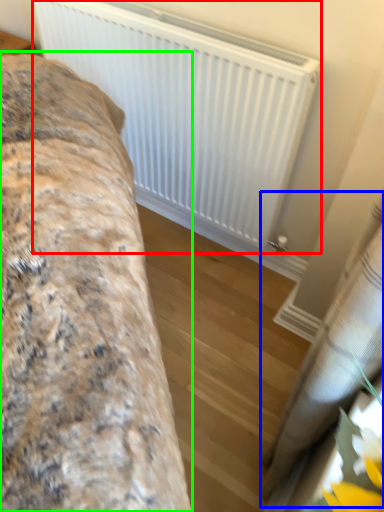
Question: Considering the real-world distances, which object is farthest from radiator (highlighted by a red box)? curtain (highlighted by a blue box) or furniture (highlighted by a green box)?

Choices:
 (A) curtain
 (B) furniture

Answer: (A)